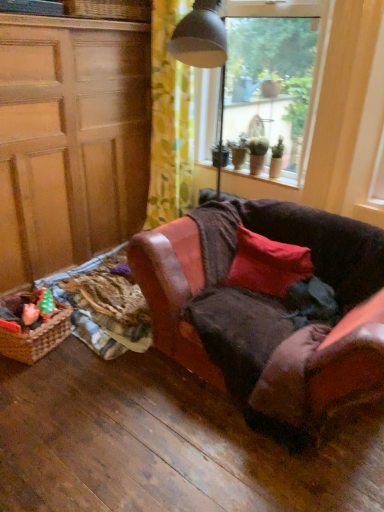
Question: From the image's perspective, is yellow floral fabric at upper center below woven wicker basket at upper left?

Choices:
 (A) yes
 (B) no

Answer: (A)

Question: Considering the relative positions of yellow floral fabric at upper center and woven wicker basket at upper left in the image provided, is yellow floral fabric at upper center to the left of woven wicker basket at upper left from the viewer's perspective?

Choices:
 (A) yes
 (B) no

Answer: (B)

Question: Is yellow floral fabric at upper center positioned behind woven wicker basket at upper left?

Choices:
 (A) no
 (B) yes

Answer: (B)

Question: Does yellow floral fabric at upper center have a greater height compared to woven wicker basket at upper left?

Choices:
 (A) no
 (B) yes

Answer: (B)

Question: Considering the relative sizes of yellow floral fabric at upper center and woven wicker basket at upper left in the image provided, is yellow floral fabric at upper center thinner than woven wicker basket at upper left?

Choices:
 (A) no
 (B) yes

Answer: (B)

Question: In terms of width, does plush pink toy at lower left look wider or thinner when compared to woven brown picnic basket at lower left?

Choices:
 (A) wide
 (B) thin

Answer: (B)

Question: From the image's perspective, is plush pink toy at lower left located above or below woven brown picnic basket at lower left?

Choices:
 (A) above
 (B) below

Answer: (A)

Question: In the image, is plush pink toy at lower left on the left side or the right side of woven brown picnic basket at lower left?

Choices:
 (A) left
 (B) right

Answer: (B)

Question: Considering the positions of plush pink toy at lower left and woven brown picnic basket at lower left in the image, is plush pink toy at lower left bigger or smaller than woven brown picnic basket at lower left?

Choices:
 (A) small
 (B) big

Answer: (A)

Question: Visually, is plush pink toy at lower left positioned to the left or to the right of transparent glass window at upper center?

Choices:
 (A) left
 (B) right

Answer: (A)

Question: Considering the positions of plush pink toy at lower left and transparent glass window at upper center in the image, is plush pink toy at lower left taller or shorter than transparent glass window at upper center?

Choices:
 (A) tall
 (B) short

Answer: (B)

Question: Relative to transparent glass window at upper center, is plush pink toy at lower left in front or behind?

Choices:
 (A) behind
 (B) front

Answer: (B)

Question: Is plush pink toy at lower left inside the boundaries of transparent glass window at upper center, or outside?

Choices:
 (A) outside
 (B) inside

Answer: (A)

Question: In terms of height, does woven wicker basket at upper left look taller or shorter compared to woven brown picnic basket at lower left?

Choices:
 (A) short
 (B) tall

Answer: (A)

Question: Is woven wicker basket at upper left to the left or to the right of woven brown picnic basket at lower left in the image?

Choices:
 (A) left
 (B) right

Answer: (B)